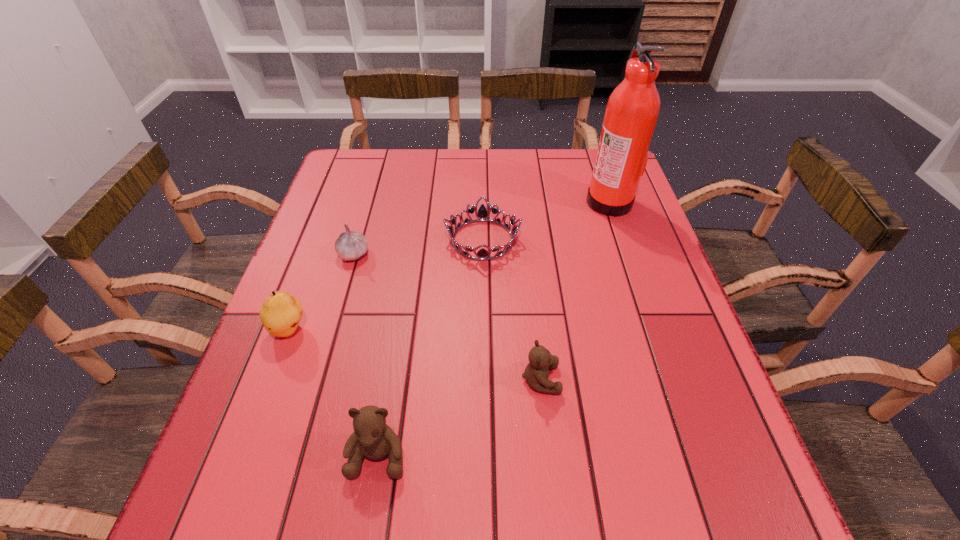
You are a GUI agent. You are given a task and a screenshot of the screen. Output one action in this format:
    pyautogui.click(x=<x>, y=<y>)
    Task: Click on the left teddy bear
    The image size is (960, 540).
    Given the screenshot: What is the action you would take?
    pyautogui.click(x=372, y=437)

The height and width of the screenshot is (540, 960). What are the coordinates of `the fourth object from right to left` in the screenshot? It's located at (372, 437).

Image resolution: width=960 pixels, height=540 pixels. Identify the location of the second nearest object. (536, 373).

Image resolution: width=960 pixels, height=540 pixels. What are the coordinates of `the shorter teddy bear` in the screenshot? It's located at (536, 373).

The width and height of the screenshot is (960, 540). I want to click on tiara, so click(482, 214).

Image resolution: width=960 pixels, height=540 pixels. In order to click on the rightmost object in this screenshot , I will do `click(632, 110)`.

At what (x,y) coordinates should I click in order to perform the action: click on the tallest object. Please return your answer as a coordinate pair (x, y). Looking at the image, I should click on (632, 110).

Locate an element on the screen. garlic is located at coordinates (351, 245).

Find the location of a particular element. This screenshot has height=540, width=960. pear is located at coordinates (281, 312).

Find the location of a particular element. The height and width of the screenshot is (540, 960). the leftmost object is located at coordinates (281, 312).